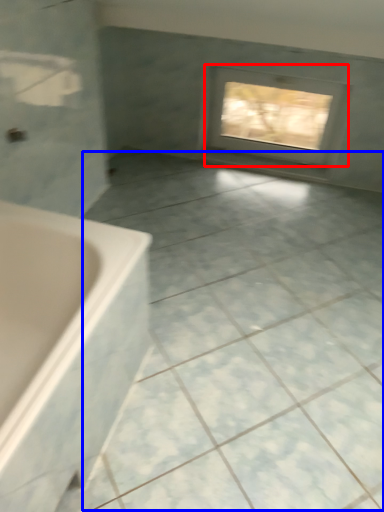
Question: Among these objects, which one is nearest to the camera, window (highlighted by a red box) or ceramic tile (highlighted by a blue box)?

Choices:
 (A) window
 (B) ceramic tile

Answer: (B)